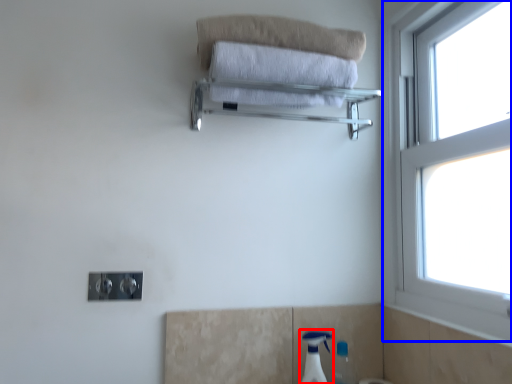
Question: Which object appears closest to the camera in this image, soap dispenser (highlighted by a red box) or window (highlighted by a blue box)?

Choices:
 (A) soap dispenser
 (B) window

Answer: (B)